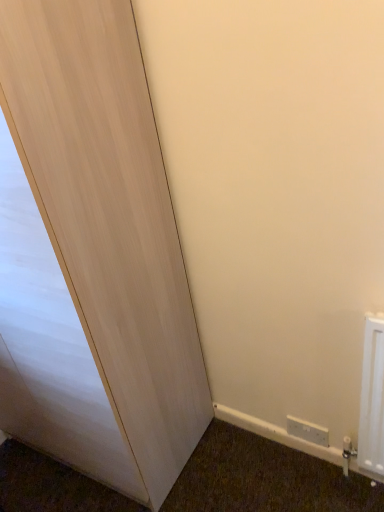
Question: Does light wood door at left have a greater width compared to white plastic electric outlet at lower right?

Choices:
 (A) no
 (B) yes

Answer: (B)

Question: Would you consider light wood door at left to be distant from white plastic electric outlet at lower right?

Choices:
 (A) no
 (B) yes

Answer: (A)

Question: Does light wood door at left turn towards white plastic electric outlet at lower right?

Choices:
 (A) no
 (B) yes

Answer: (A)

Question: Is light wood door at left positioned in front of white plastic electric outlet at lower right?

Choices:
 (A) yes
 (B) no

Answer: (A)

Question: From the image's perspective, does light wood door at left appear higher than white plastic electric outlet at lower right?

Choices:
 (A) yes
 (B) no

Answer: (A)

Question: From a real-world perspective, is light wood door at left over white plastic electric outlet at lower right?

Choices:
 (A) yes
 (B) no

Answer: (A)

Question: Does white plastic electric outlet at lower right appear on the left side of light wood door at left?

Choices:
 (A) yes
 (B) no

Answer: (B)

Question: Is white plastic electric outlet at lower right thinner than light wood door at left?

Choices:
 (A) no
 (B) yes

Answer: (B)

Question: Would you say light wood door at left is part of white plastic electric outlet at lower right's contents?

Choices:
 (A) yes
 (B) no

Answer: (B)

Question: Considering the relative positions of white plastic electric outlet at lower right and light wood door at left in the image provided, is white plastic electric outlet at lower right in front of light wood door at left?

Choices:
 (A) yes
 (B) no

Answer: (B)

Question: Is white plastic electric outlet at lower right outside light wood door at left?

Choices:
 (A) no
 (B) yes

Answer: (B)

Question: Can you confirm if white plastic electric outlet at lower right is taller than light wood door at left?

Choices:
 (A) no
 (B) yes

Answer: (A)

Question: In terms of height, does white plastic electric outlet at lower right look taller or shorter compared to light wood door at left?

Choices:
 (A) tall
 (B) short

Answer: (B)